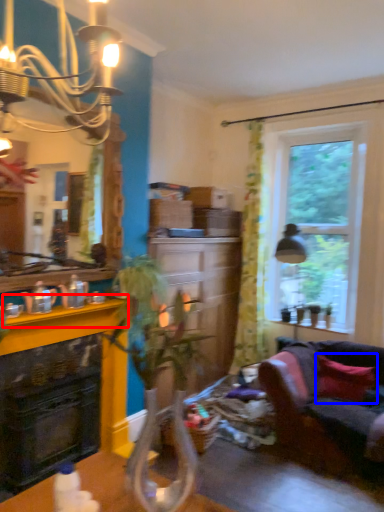
Question: Among these objects, which one is nearest to the camera, counter top (highlighted by a red box) or pillow (highlighted by a blue box)?

Choices:
 (A) counter top
 (B) pillow

Answer: (A)